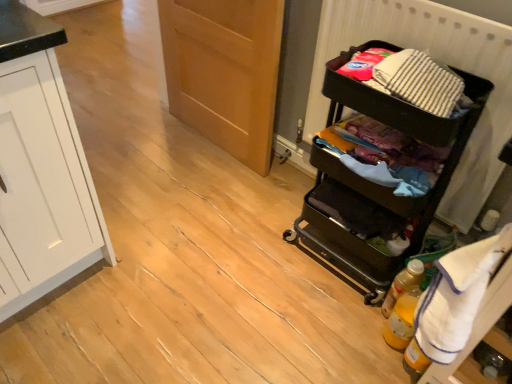
Question: Considering the positions of white terry cloth towel at right and translucent yellow bottle at lower right, arranged as the 2th bottle when viewed from the back, in the image, is white terry cloth towel at right wider or thinner than translucent yellow bottle at lower right, arranged as the 2th bottle when viewed from the back,?

Choices:
 (A) wide
 (B) thin

Answer: (A)

Question: Choose the correct answer: Is white terry cloth towel at right inside translucent yellow bottle at lower right, arranged as the 2th bottle when viewed from the back, or outside it?

Choices:
 (A) outside
 (B) inside

Answer: (A)

Question: Estimate the real-world distances between objects in this image. Which object is farther from the white terry cloth towel at right?

Choices:
 (A) translucent yellow bottle at lower right, arranged as the 2th bottle when viewed from the back
 (B) wooden door at center
 (C) striped cotton laundry at right
 (D) translucent yellow bottle at lower right, marked as the second bottle in a front-to-back arrangement
 (E) black plastic cart at right

Answer: (B)

Question: Estimate the real-world distances between objects in this image. Which object is farther from the white terry cloth towel at right?

Choices:
 (A) translucent yellow bottle at lower right, the first bottle viewed from the back
 (B) translucent yellow bottle at lower right, placed as the first bottle when sorted from front to back
 (C) black plastic cart at right
 (D) wooden door at center
 (E) striped cotton laundry at right

Answer: (D)